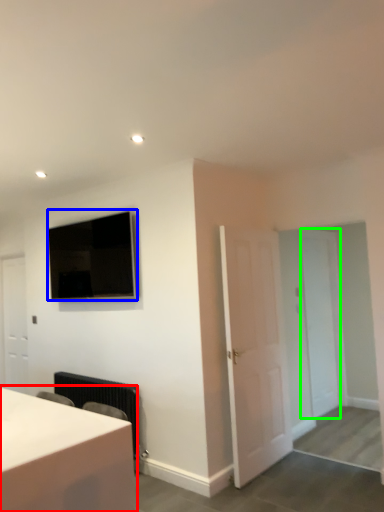
Question: Considering the real-world distances, which object is farthest from table (highlighted by a red box)? television (highlighted by a blue box) or door (highlighted by a green box)?

Choices:
 (A) television
 (B) door

Answer: (B)